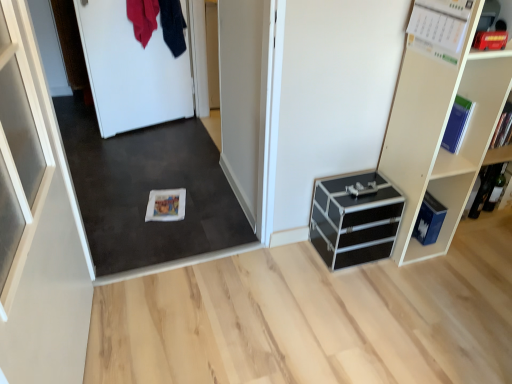
Question: Based on their positions, is white paper calendar at upper right, positioned as the first book in front-to-back order, located to the left or right of black aluminum chest of drawers at lower right?

Choices:
 (A) left
 (B) right

Answer: (B)

Question: Is white paper calendar at upper right, placed as the 3th book when sorted from right to left, inside or outside of black aluminum chest of drawers at lower right?

Choices:
 (A) outside
 (B) inside

Answer: (A)

Question: Which object is the closest to the hardcover book at right, arranged as the second book when ordered from the bottom?

Choices:
 (A) white matte book at center, the fourth book when ordered from right to left
 (B) black aluminum chest of drawers at lower right
 (C) blue matte book at upper right, which ranks as the third book in left-to-right order
 (D) white matte carpet at center
 (E) white paper calendar at upper right, placed as the 3th book when sorted from right to left

Answer: (C)

Question: Estimate the real-world distances between objects in this image. Which object is closer to the white matte door at upper left?

Choices:
 (A) blue matte book at upper right, which appears as the second book when viewed from the right
 (B) white paper calendar at upper right, arranged as the fourth book when viewed from the back
 (C) dark blue fabric at upper left, marked as the 1th clothing in a right-to-left arrangement
 (D) white matte book at center, which is the fourth book from front to back
 (E) white matte carpet at center

Answer: (C)